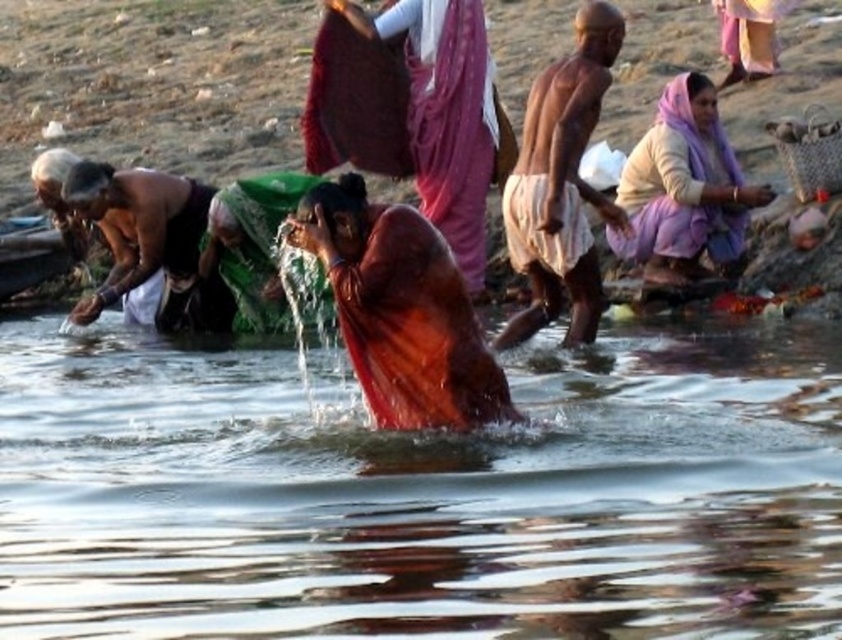
Question: Is purple fabric headscarf at upper right behind dark skin man at left?

Choices:
 (A) yes
 (B) no

Answer: (B)

Question: Which is farther from the transparent water at center?

Choices:
 (A) matte orange robe at center
 (B) dark skin man at left

Answer: (A)

Question: Which is nearer to the matte orange robe at center?

Choices:
 (A) dark skin man at left
 (B) matte orange cloth at center

Answer: (A)

Question: Observing the image, what is the correct spatial positioning of transparent water at center in reference to purple fabric headscarf at upper right?

Choices:
 (A) right
 (B) left

Answer: (B)

Question: Which point appears closest to the camera in this image?

Choices:
 (A) (653, 220)
 (B) (537, 326)
 (C) (443, 234)
 (D) (396, 253)

Answer: (D)

Question: Can you confirm if brown skin man at center is positioned below purple fabric headscarf at upper right?

Choices:
 (A) yes
 (B) no

Answer: (A)